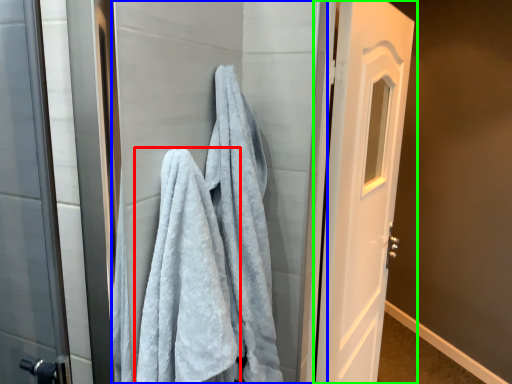
Question: Considering the real-world distances, which object is farthest from towel (highlighted by a red box)? screen door (highlighted by a blue box) or door (highlighted by a green box)?

Choices:
 (A) screen door
 (B) door

Answer: (B)